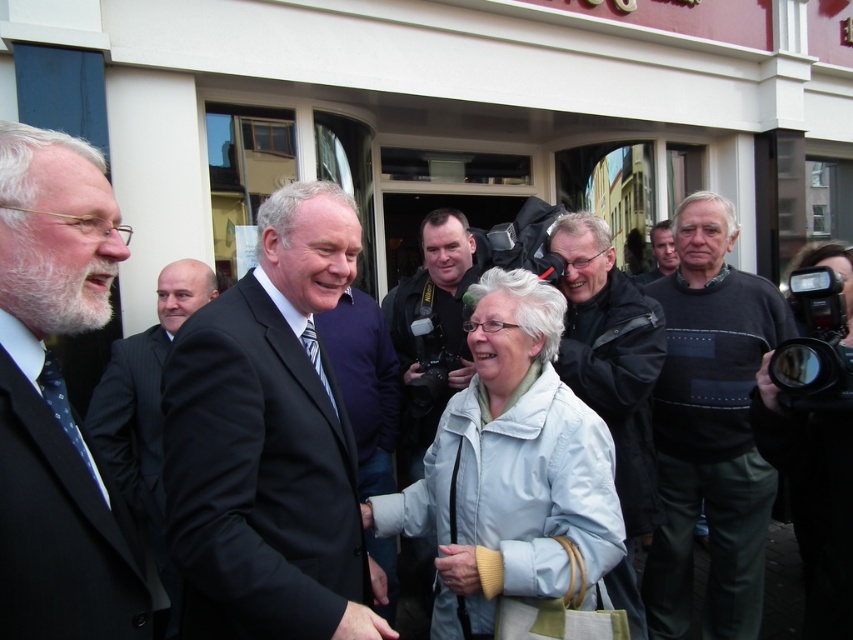
Question: Is light gray jacket at center positioned in front of smooth skin hand at center?

Choices:
 (A) yes
 (B) no

Answer: (B)

Question: Considering the relative positions of black suit at center and black pinstripe suit at left in the image provided, where is black suit at center located with respect to black pinstripe suit at left?

Choices:
 (A) above
 (B) below

Answer: (A)

Question: Among these objects, which one is nearest to the camera?

Choices:
 (A) light blue fabric jacket at center
 (B) light gray jacket at center
 (C) black pinstripe suit at left
 (D) black suit at center

Answer: (D)

Question: Does black suit at center lie behind black pinstripe suit at left?

Choices:
 (A) yes
 (B) no

Answer: (B)

Question: Which object is closer to the camera taking this photo?

Choices:
 (A) dark gray jacket at center
 (B) dark gray sweater at right
 (C) light blue fabric jacket at center

Answer: (C)

Question: Which point is farther from the camera taking this photo?

Choices:
 (A) (640, 627)
 (B) (134, 474)
 (C) (461, 268)

Answer: (C)